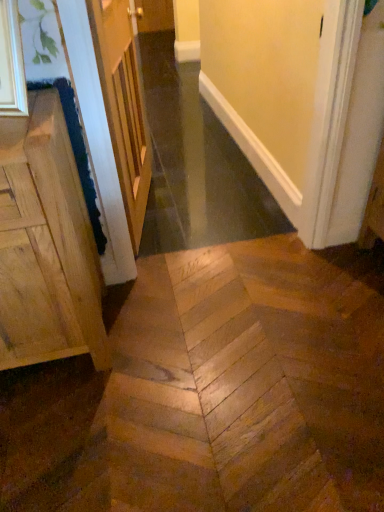
Question: Would you say wooden door at upper left is inside or outside natural wood cabinet at left?

Choices:
 (A) inside
 (B) outside

Answer: (B)

Question: In the image, is wooden door at upper left positioned in front of or behind natural wood cabinet at left?

Choices:
 (A) front
 (B) behind

Answer: (B)

Question: Is wooden door at upper left wider or thinner than natural wood cabinet at left?

Choices:
 (A) wide
 (B) thin

Answer: (B)

Question: Do you think natural wood cabinet at left is within wooden door at upper left, or outside of it?

Choices:
 (A) inside
 (B) outside

Answer: (B)

Question: From a real-world perspective, is natural wood cabinet at left physically located above or below wooden door at upper left?

Choices:
 (A) above
 (B) below

Answer: (B)

Question: Is natural wood cabinet at left wider or thinner than wooden door at upper left?

Choices:
 (A) thin
 (B) wide

Answer: (B)

Question: From the image's perspective, is natural wood cabinet at left above or below wooden door at upper left?

Choices:
 (A) below
 (B) above

Answer: (A)